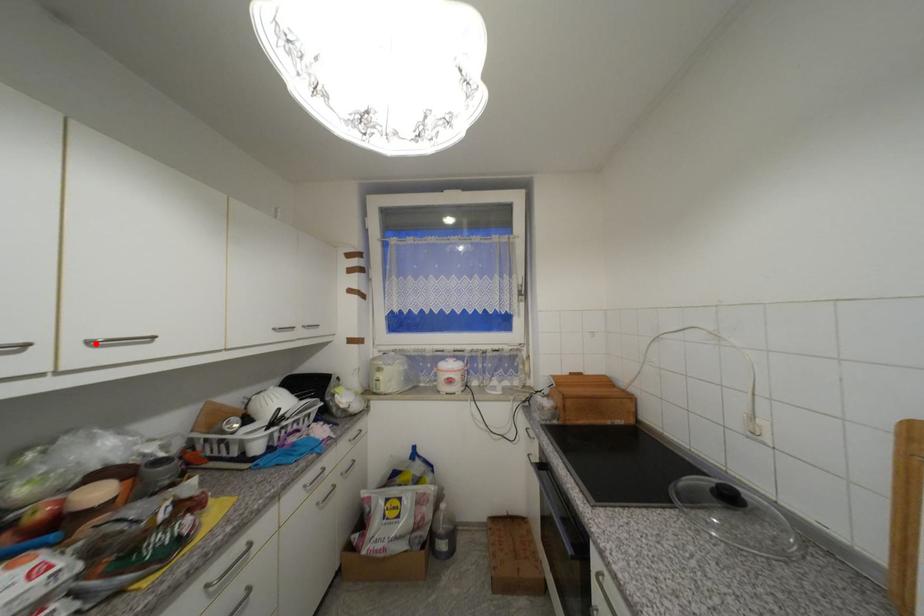
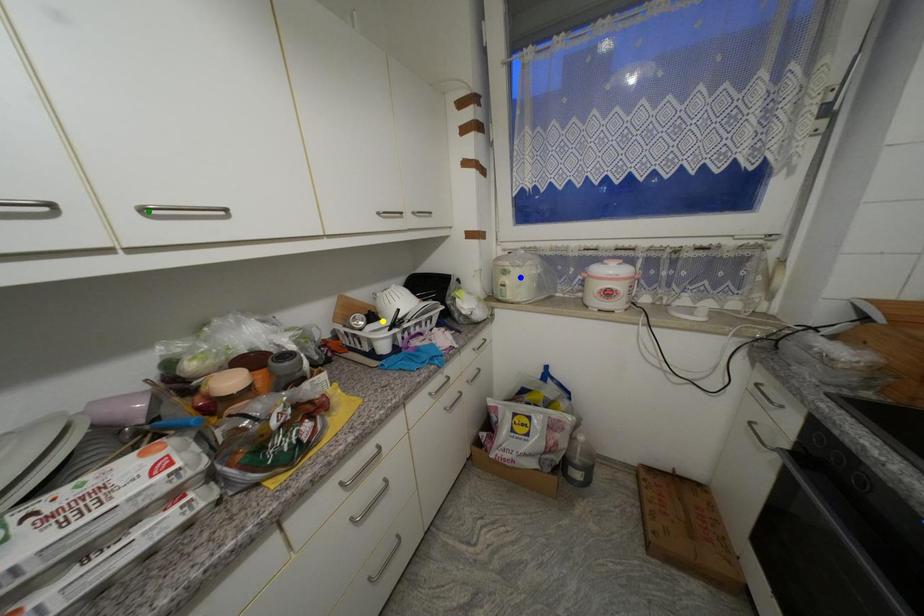
Question: I am providing you with two images of the same scene from different viewpoints. A red point is marked on the first image. You are given multiple points on the second image. In image 2, which mark is for the same physical point as the one in image 1?

Choices:
 (A) yellow point
 (B) blue point
 (C) green point

Answer: (C)